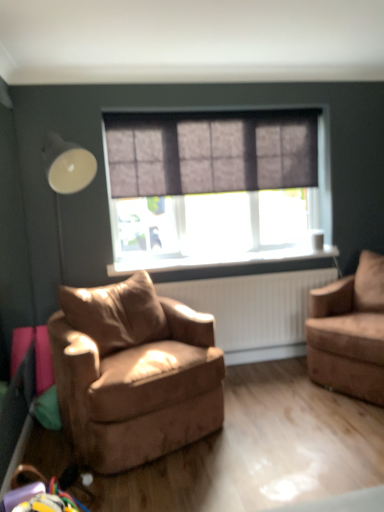
Locate an element on the screen. The image size is (384, 512). spots to the right of brown leather chair at center, which appears as the 1th chair when viewed from the left is located at coordinates (272, 422).